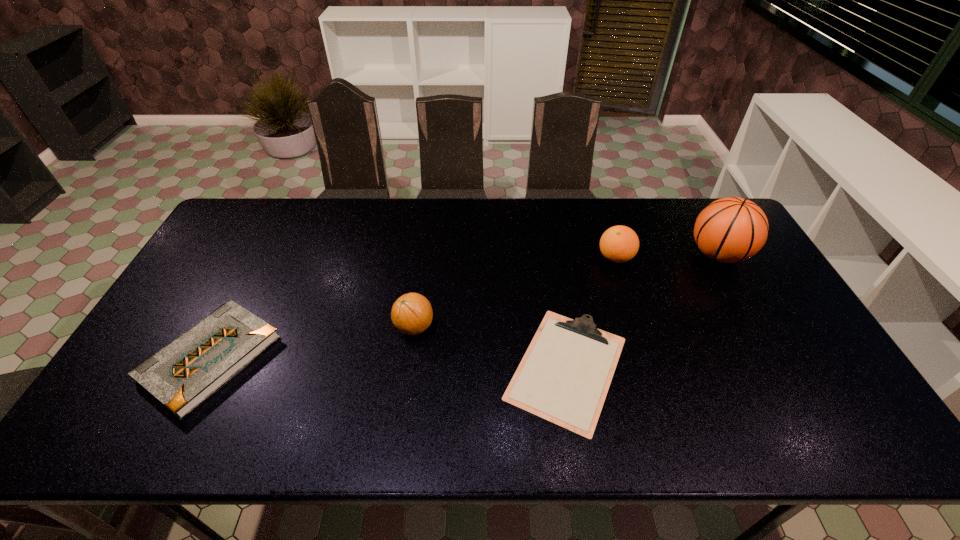
I want to click on vacant space that is in between the farther orange and the nearer orange, so click(515, 292).

Locate an element on the screen. This screenshot has height=540, width=960. vacant area that lies between the basketball and the nearer orange is located at coordinates (566, 291).

Identify the location of free area in between the tallest object and the shortest object. Image resolution: width=960 pixels, height=540 pixels. (642, 312).

Where is `the second closest object relative to the notebook`? the second closest object relative to the notebook is located at coordinates (564, 376).

Identify which object is located as the third nearest to the nearer orange. Please provide its 2D coordinates. Your answer should be formatted as a tuple, i.e. [(x, y)], where the tuple contains the x and y coordinates of a point satisfying the conditions above.

[(619, 244)]

Identify the location of vacant area in the image that satisfies the following two spatial constraints: 1. on the back side of the rightmost object; 2. on the left side of the right orange. (614, 254).

Image resolution: width=960 pixels, height=540 pixels. In order to click on free spot that satisfies the following two spatial constraints: 1. on the back side of the right orange; 2. on the left side of the leftmost object in this screenshot , I will do `click(263, 258)`.